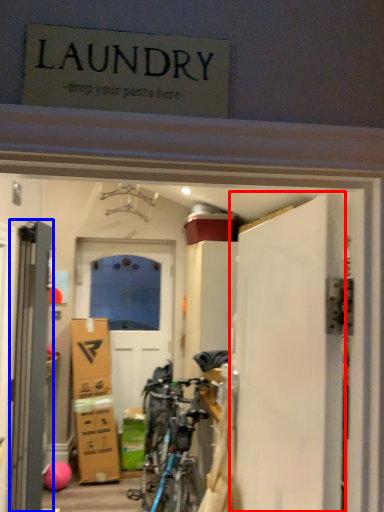
Question: Among these objects, which one is farthest to the camera, door (highlighted by a red box) or door (highlighted by a blue box)?

Choices:
 (A) door
 (B) door

Answer: (B)